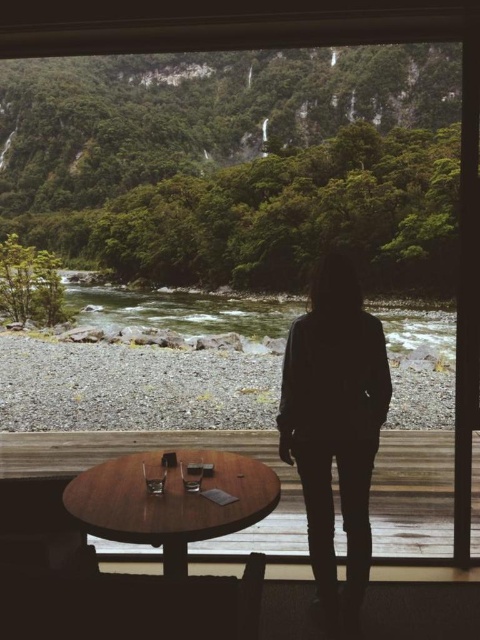
You are sitting at the wooden table at lower center and want to look at the gray gravel river at center. Which direction should you move to get a better view of the river?

Since the wooden table at lower center is closer to the viewer than the gray gravel river at center, you should move forward away from the table to get a better view of the gray gravel river at center.

You are a guest in this room and want to place a large plant pot on the wooden table at lower center. Considering the size of the table compared to the gray gravel river at center, will the table have enough space for the pot?

The wooden table at lower center is smaller than the gray gravel river at center. However, the size comparison between the table and the river does not provide information about the table itself. Therefore, it is unclear if the wooden table at lower center has enough space for the large plant pot.